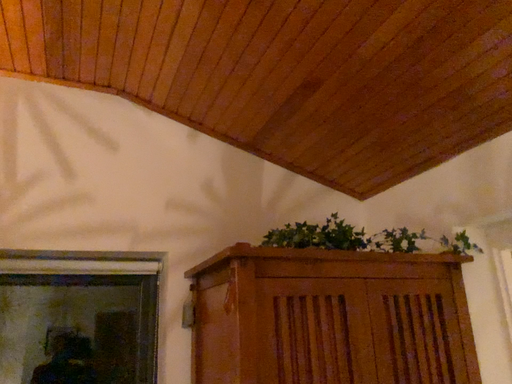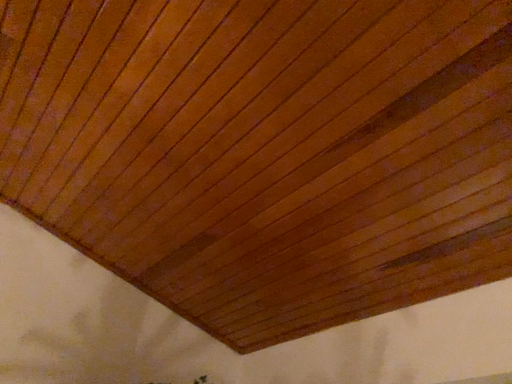
Question: How did the camera likely rotate when shooting the video?

Choices:
 (A) rotated downward
 (B) rotated upward

Answer: (B)